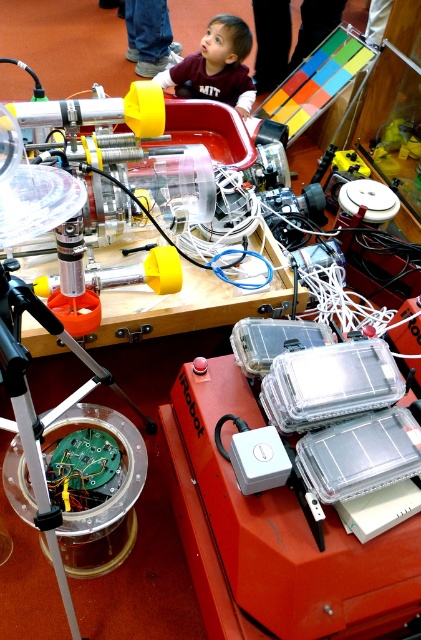
From the picture: Is silver metallic tripod at lower left above maroon cotton shirt at upper center?

Incorrect, silver metallic tripod at lower left is not positioned above maroon cotton shirt at upper center.

Measure the distance from silver metallic tripod at lower left to maroon cotton shirt at upper center.

silver metallic tripod at lower left is 7.72 feet away from maroon cotton shirt at upper center.

Who is more distant from viewer, (122, 556) or (221, 48)?

Point (221, 48)

At what (x,y) coordinates should I click in order to perform the action: click on silver metallic tripod at lower left. Please return your answer as a coordinate pair (x, y). This screenshot has width=421, height=640. Looking at the image, I should click on (66, 451).